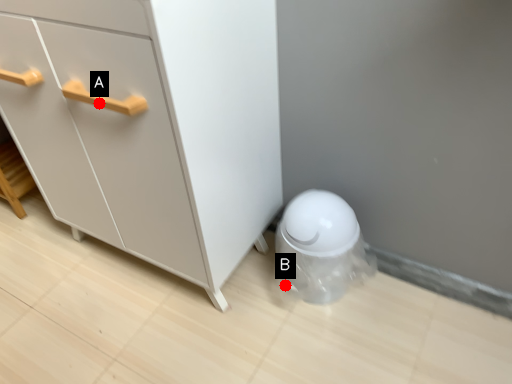
Question: Two points are circled on the image, labeled by A and B beside each circle. Among these points, which one is farthest from the camera?

Choices:
 (A) A is further
 (B) B is further

Answer: (B)